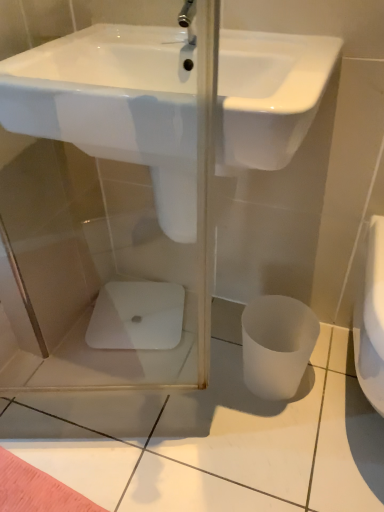
Question: Is white glossy sink at upper center next to white matte toilet bowl at lower right and touching it?

Choices:
 (A) yes
 (B) no

Answer: (B)

Question: Does white glossy sink at upper center have a lesser width compared to white matte toilet bowl at lower right?

Choices:
 (A) yes
 (B) no

Answer: (B)

Question: Could you tell me if white glossy sink at upper center is facing white matte toilet bowl at lower right?

Choices:
 (A) no
 (B) yes

Answer: (A)

Question: Considering the relative sizes of white glossy sink at upper center and white matte toilet bowl at lower right in the image provided, is white glossy sink at upper center wider than white matte toilet bowl at lower right?

Choices:
 (A) no
 (B) yes

Answer: (B)

Question: From a real-world perspective, is white glossy sink at upper center positioned over white matte toilet bowl at lower right based on gravity?

Choices:
 (A) yes
 (B) no

Answer: (A)

Question: Can you confirm if white glossy sink at upper center is positioned to the left of white matte toilet bowl at lower right?

Choices:
 (A) no
 (B) yes

Answer: (B)

Question: Can you confirm if white matte toilet bowl at lower right is wider than white glossy sink at upper center?

Choices:
 (A) yes
 (B) no

Answer: (B)

Question: Is white matte toilet bowl at lower right surrounding white glossy sink at upper center?

Choices:
 (A) no
 (B) yes

Answer: (A)

Question: Is white matte toilet bowl at lower right taller than white glossy sink at upper center?

Choices:
 (A) yes
 (B) no

Answer: (A)

Question: Does white matte toilet bowl at lower right have a lesser height compared to white glossy sink at upper center?

Choices:
 (A) no
 (B) yes

Answer: (A)

Question: From a real-world perspective, is white matte toilet bowl at lower right under white glossy sink at upper center?

Choices:
 (A) yes
 (B) no

Answer: (A)

Question: Is white matte toilet bowl at lower right next to white glossy sink at upper center and touching it?

Choices:
 (A) yes
 (B) no

Answer: (B)

Question: Is white glossy porcelain at center with white matte toilet bowl at lower right?

Choices:
 (A) yes
 (B) no

Answer: (B)